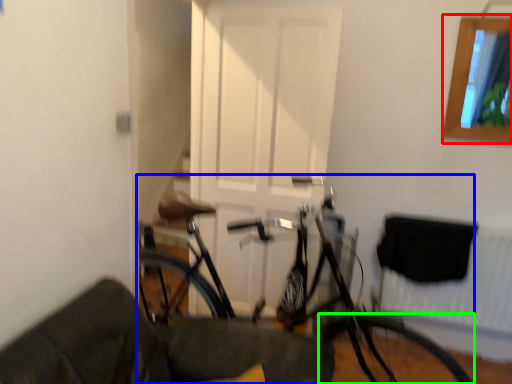
Question: Which is nearer to the window (highlighted by a red box)? bicycle (highlighted by a blue box) or bicycle wheel (highlighted by a green box).

Choices:
 (A) bicycle
 (B) bicycle wheel

Answer: (A)